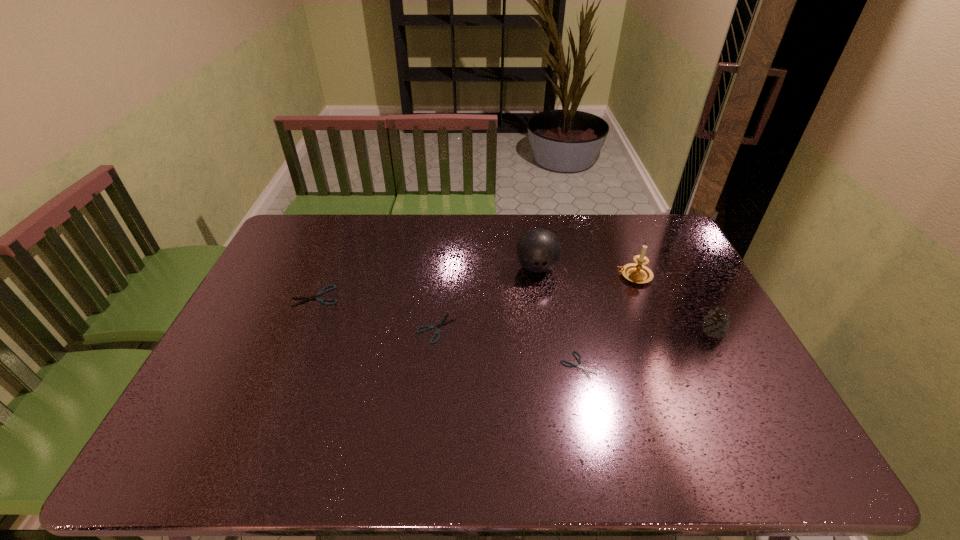
In the current image, all shearss are evenly spaced. To maintain this equal spacing, where should an additional shears be placed on the right? Please point out a free spot. Please provide its 2D coordinates. Your answer should be formatted as a tuple, i.e. [(x, y)], where the tuple contains the x and y coordinates of a point satisfying the conditions above.

[(747, 410)]